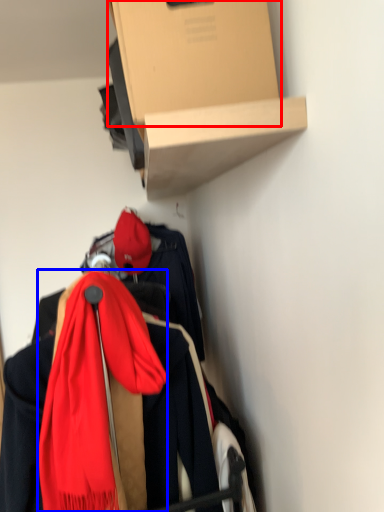
Question: Which object appears closest to the camera in this image, cardboard box (highlighted by a red box) or scarf (highlighted by a blue box)?

Choices:
 (A) cardboard box
 (B) scarf

Answer: (A)